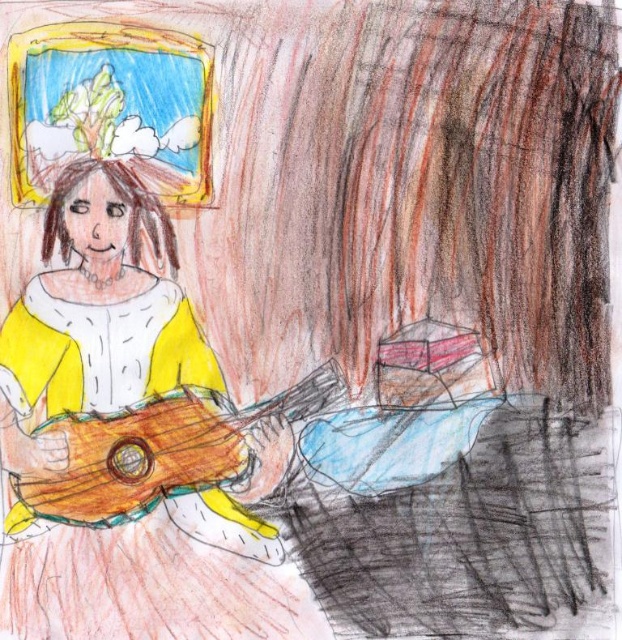
Does point (248, 636) come in front of point (223, 417)?

Yes, it is.

Can you confirm if matte yellow dress at left is smaller than wooden guitar at lower left?

Incorrect, matte yellow dress at left is not smaller in size than wooden guitar at lower left.

Where is `matte yellow dress at left`? matte yellow dress at left is located at coordinates (131, 445).